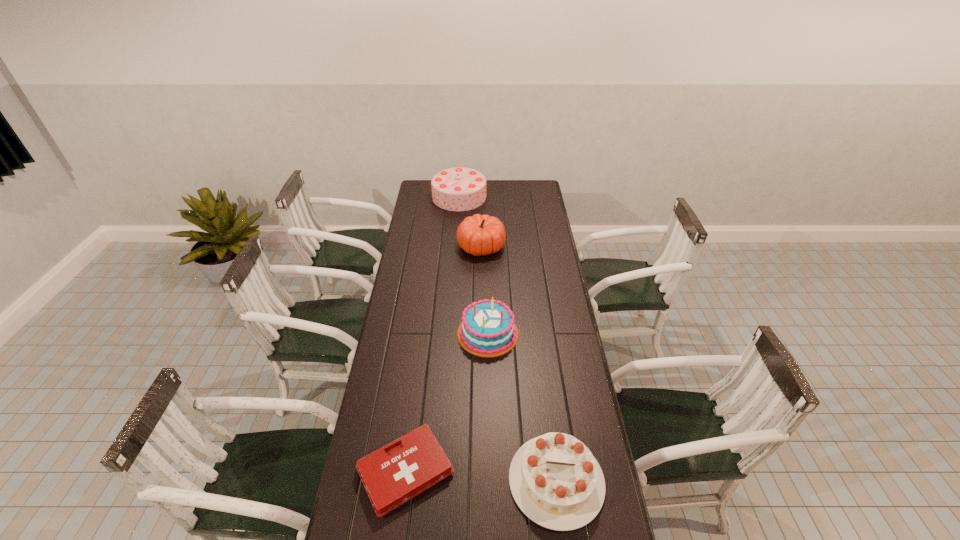
Locate an element on the screen. free location located on the right of the second farthest birthday cake is located at coordinates (565, 333).

At what (x,y) coordinates should I click in order to perform the action: click on vacant space located 0.090m on the left of the fourth tallest object. Please return your answer as a coordinate pair (x, y). The image size is (960, 540). Looking at the image, I should click on (481, 481).

I want to click on vacant space situated 0.390m on the right of the first-aid kit, so pos(575,471).

Find the location of a particular element. This screenshot has width=960, height=540. object that is positioned at the far edge is located at coordinates (455, 189).

At what (x,y) coordinates should I click in order to perform the action: click on birthday cake located in the left edge section of the desktop. Please return your answer as a coordinate pair (x, y). Looking at the image, I should click on [455, 189].

This screenshot has width=960, height=540. I want to click on the first-aid kit at the left edge, so 392,475.

Locate an element on the screen. object that is at the right edge is located at coordinates (555, 480).

Image resolution: width=960 pixels, height=540 pixels. What are the coordinates of `object that is at the far left corner` in the screenshot? It's located at (455, 189).

At what (x,y) coordinates should I click in order to perform the action: click on vacant area at the far edge of the desktop. Please return your answer as a coordinate pair (x, y). The height and width of the screenshot is (540, 960). Looking at the image, I should click on (503, 180).

At what (x,y) coordinates should I click in order to perform the action: click on free space at the left edge of the desktop. Please return your answer as a coordinate pair (x, y). The width and height of the screenshot is (960, 540). Looking at the image, I should click on (422, 342).